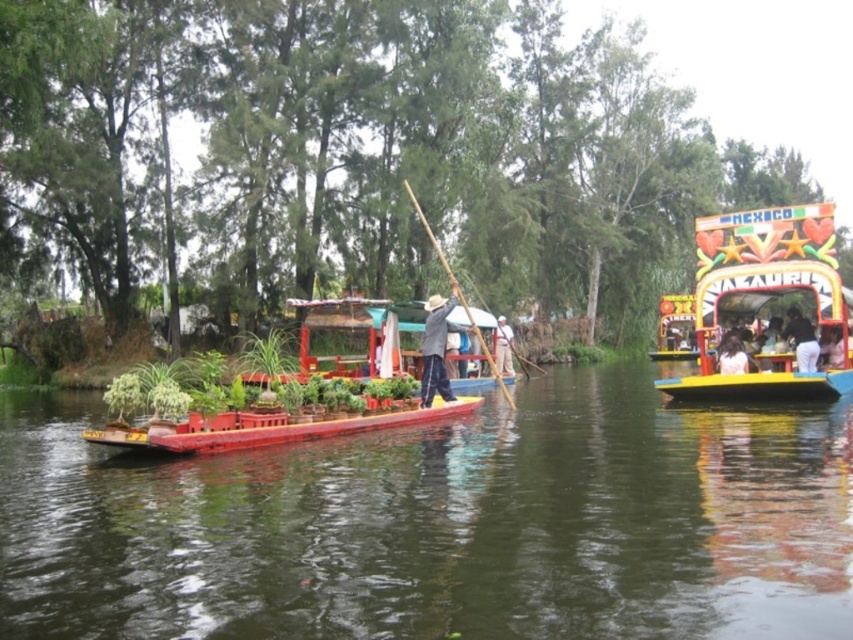
This screenshot has height=640, width=853. Describe the element at coordinates (802, 340) in the screenshot. I see `smooth yellow boat at center` at that location.

Consider the image. Between smooth yellow boat at center and white matte person at center, which one appears on the left side from the viewer's perspective?

white matte person at center

Describe the element at coordinates (802, 340) in the screenshot. This screenshot has width=853, height=640. I see `smooth yellow boat at center` at that location.

Identify the location of smooth yellow boat at center. This screenshot has width=853, height=640. (802, 340).

Is matte gray hat at center taller than light brown wooden boat at center?

Yes.

Is matte gray hat at center below light brown wooden boat at center?

No.

The height and width of the screenshot is (640, 853). Find the location of `matte gray hat at center`. matte gray hat at center is located at coordinates (503, 348).

Which is below, smooth wood river at center or white matte person at center?

smooth wood river at center is below.

Which is above, smooth wood river at center or white matte person at center?

white matte person at center is above.

This screenshot has height=640, width=853. I want to click on smooth wood river at center, so click(440, 524).